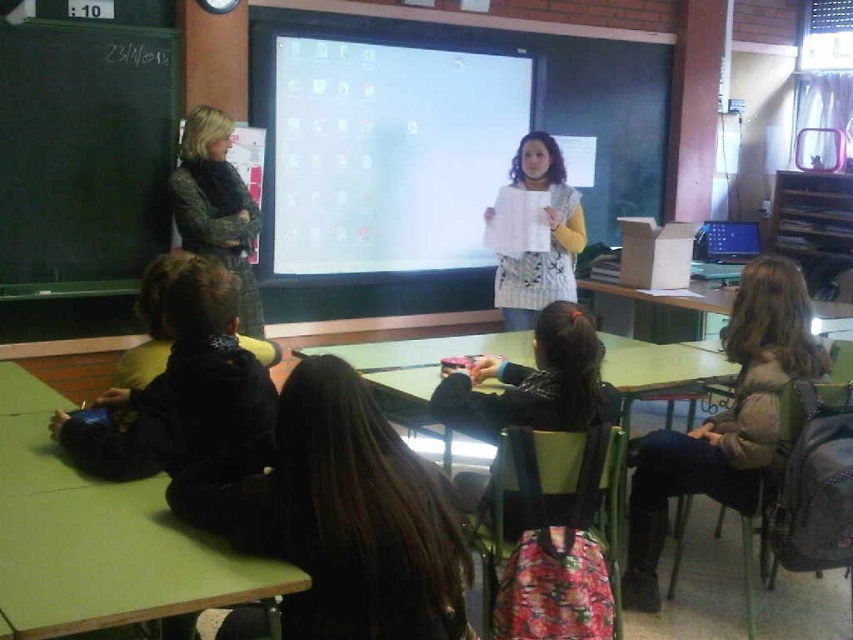
In the scene shown: Is white glossy screen at center shorter than camouflage-patterned sweater at left?

No, white glossy screen at center is not shorter than camouflage-patterned sweater at left.

Which is more to the right, white glossy screen at center or camouflage-patterned sweater at left?

From the viewer's perspective, white glossy screen at center appears more on the right side.

Which is behind, point (320, 42) or point (202, 200)?

The point (320, 42) is more distant.

Where is `white glossy screen at center`? This screenshot has width=853, height=640. white glossy screen at center is located at coordinates (389, 154).

Is camouflage-patterned sweater at left taller than white knitted sweater at center?

Yes.

Is camouflage-patterned sweater at left shorter than white knitted sweater at center?

No.

Is point (218, 152) closer to camera compared to point (554, 292)?

Yes.

This screenshot has height=640, width=853. In order to click on camouflage-patterned sweater at left in this screenshot , I will do `click(216, 205)`.

Can you confirm if white glossy screen at center is bigger than black matte jacket at center?

Yes.

Is white glossy screen at center smaller than black matte jacket at center?

Incorrect, white glossy screen at center is not smaller in size than black matte jacket at center.

Is point (453, 237) farther from camera compared to point (440, 563)?

Yes.

Where is `white glossy screen at center`? white glossy screen at center is located at coordinates (389, 154).